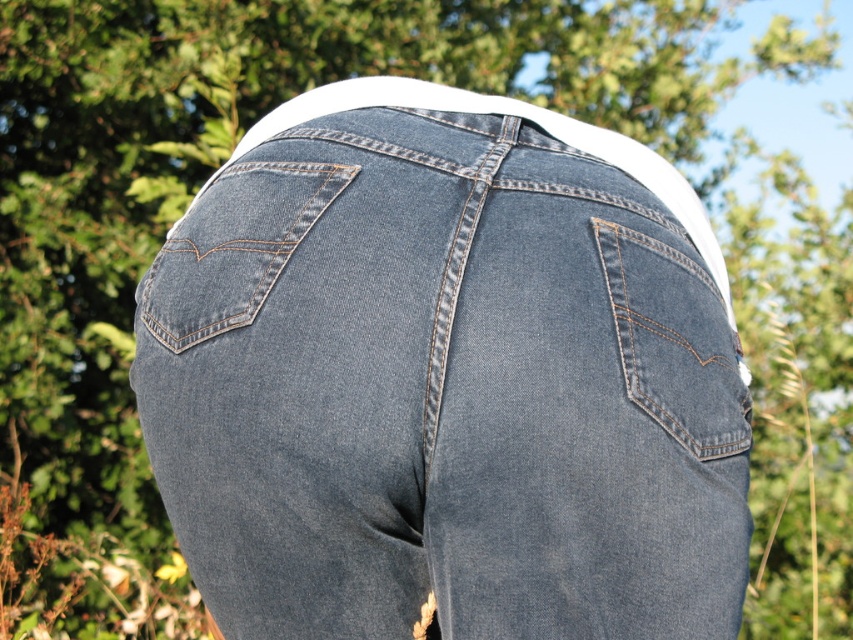
You are standing 1.5 meters away from the camera. You want to reach the point at point (653, 307). Can you reach it without moving closer to the camera?

The distance of point (653, 307) from camera is 1.35 meters. Since you are standing 1.5 meters away from the camera, you are farther away than the point. Therefore, you can reach it without moving closer to the camera.

You are a photographer taking a picture of the denim clothing in the scene. Which part of the denim clothing is closer to your camera lens, the denim at center or the denim at left?

The denim at center is closer to the viewer than denim at left, so the denim at center will appear larger in the photo.

You are a tailor trying to repair a pair of jeans. You notice two areas that need mending. One is the denim pocket at right and the other is the denim at left. Which area requires more fabric if the repair requires covering the entire width of each area?

The denim at left requires more fabric because its width is greater than the denim pocket at right, as stated in the description.